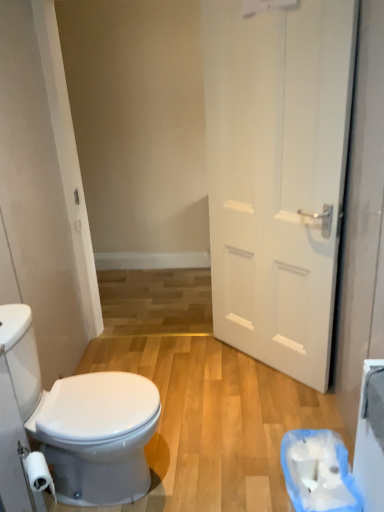
This screenshot has width=384, height=512. Describe the element at coordinates (320, 472) in the screenshot. I see `white paper at lower right, the 2th toilet paper positioned from the left` at that location.

Describe the element at coordinates (97, 436) in the screenshot. The width and height of the screenshot is (384, 512). I see `white glossy bidet at lower left` at that location.

Where is `white matte door at right`? white matte door at right is located at coordinates (277, 175).

Consider the image. What's the angular difference between white matte door at right and white glossy bidet at lower left's facing directions?

133 degrees.

Measure the distance from white matte door at right to white glossy bidet at lower left.

3.76 feet.

The image size is (384, 512). In order to click on bidet in front of the white matte door at right in this screenshot , I will do `click(97, 436)`.

From the image's perspective, is white matte door at right beneath white glossy bidet at lower left?

No, from the image's perspective, white matte door at right is not below white glossy bidet at lower left.

Which object is wider, white paper at lower right, arranged as the second toilet paper when viewed from the front, or white glossy bidet at lower left?

With larger width is white glossy bidet at lower left.

Is point (329, 464) in front of point (86, 390)?

Yes, point (329, 464) is in front of point (86, 390).

From the image's perspective, is white paper at lower right, arranged as the second toilet paper when viewed from the front, located above or below white glossy bidet at lower left?

A: Based on their image positions, white paper at lower right, arranged as the second toilet paper when viewed from the front, is located beneath white glossy bidet at lower left.

Would you say white paper at lower right, arranged as the second toilet paper when viewed from the front, contains white glossy bidet at lower left?

No.

Is white glossy bidet at lower left wider or thinner than white matte door at right?

Clearly, white glossy bidet at lower left has more width compared to white matte door at right.

In the scene shown: Which of these two, white glossy bidet at lower left or white matte door at right, stands taller?

white matte door at right.

From the image's perspective, does white glossy bidet at lower left appear lower than white matte door at right?

Yes.

In the scene shown: Does white glossy bidet at lower left have a smaller size compared to white matte toilet paper at lower left, the first toilet paper when ordered from left to right?

No, white glossy bidet at lower left is not smaller than white matte toilet paper at lower left, the first toilet paper when ordered from left to right.

From a real-world perspective, is white glossy bidet at lower left positioned under white matte toilet paper at lower left, which appears as the 1th toilet paper when viewed from the front, based on gravity?

Correct, in the physical world, white glossy bidet at lower left is lower than white matte toilet paper at lower left, which appears as the 1th toilet paper when viewed from the front.

From the image's perspective, which toilet paper is the 1st one below the white glossy bidet at lower left? Please provide its 2D coordinates.

[(38, 473)]

Looking at this image, which point is more forward, (96, 490) or (43, 459)?

The point (43, 459) is closer to the camera.

From the picture: Measure the distance between white matte toilet paper at lower left, the 2th toilet paper in the right-to-left sequence, and white paper at lower right, the 2th toilet paper positioned from the left.

A distance of 92.45 centimeters exists between white matte toilet paper at lower left, the 2th toilet paper in the right-to-left sequence, and white paper at lower right, the 2th toilet paper positioned from the left.

From a real-world perspective, who is located lower, white matte toilet paper at lower left, which appears as the 1th toilet paper when viewed from the front, or white paper at lower right, arranged as the second toilet paper when viewed from the front?

From a 3D spatial view, white paper at lower right, arranged as the second toilet paper when viewed from the front, is below.

Between white matte toilet paper at lower left, the first toilet paper when ordered from left to right, and white paper at lower right, arranged as the second toilet paper when viewed from the front, which one has more height?

white paper at lower right, arranged as the second toilet paper when viewed from the front.

From the image's perspective, is white matte toilet paper at lower left, the 2th toilet paper in the right-to-left sequence, located above or below white paper at lower right, acting as the first toilet paper starting from the right?

white matte toilet paper at lower left, the 2th toilet paper in the right-to-left sequence, is situated higher than white paper at lower right, acting as the first toilet paper starting from the right, in the image.

Is white matte door at right taller than white matte toilet paper at lower left, arranged as the 2th toilet paper when viewed from the back?

Correct, white matte door at right is much taller as white matte toilet paper at lower left, arranged as the 2th toilet paper when viewed from the back.

From the image's perspective, between white matte door at right and white matte toilet paper at lower left, the 2th toilet paper in the right-to-left sequence, who is located below?

white matte toilet paper at lower left, the 2th toilet paper in the right-to-left sequence, is shown below in the image.

Could you tell me if white matte door at right is facing white matte toilet paper at lower left, arranged as the 2th toilet paper when viewed from the back?

Yes, white matte door at right is oriented towards white matte toilet paper at lower left, arranged as the 2th toilet paper when viewed from the back.

Is white paper at lower right, which is counted as the 1th toilet paper, starting from the back, bigger or smaller than white matte toilet paper at lower left, the 2th toilet paper in the right-to-left sequence?

white paper at lower right, which is counted as the 1th toilet paper, starting from the back, is bigger than white matte toilet paper at lower left, the 2th toilet paper in the right-to-left sequence.

From their relative heights in the image, would you say white paper at lower right, acting as the first toilet paper starting from the right, is taller or shorter than white matte toilet paper at lower left, arranged as the 2th toilet paper when viewed from the back?

Considering their sizes, white paper at lower right, acting as the first toilet paper starting from the right, has more height than white matte toilet paper at lower left, arranged as the 2th toilet paper when viewed from the back.

Which object is further away from the camera taking this photo, white paper at lower right, which is counted as the 1th toilet paper, starting from the back, or white matte toilet paper at lower left, arranged as the 2th toilet paper when viewed from the back?

white paper at lower right, which is counted as the 1th toilet paper, starting from the back, is further from the camera.

Is white paper at lower right, arranged as the second toilet paper when viewed from the front, looking in the opposite direction of white matte toilet paper at lower left, the 2th toilet paper in the right-to-left sequence?

That's not correct — white paper at lower right, arranged as the second toilet paper when viewed from the front, is not looking away from white matte toilet paper at lower left, the 2th toilet paper in the right-to-left sequence.

Find the location of a particular element. The width and height of the screenshot is (384, 512). door lying on the right of white glossy bidet at lower left is located at coordinates (277, 175).

From the white glossy bidet at lower left, count 1st toilet papers forward and point to it. Please provide its 2D coordinates.

[(320, 472)]

From the image, which object appears to be farther from white matte toilet paper at lower left, the first toilet paper when ordered from left to right, white glossy bidet at lower left or white paper at lower right, the 2th toilet paper positioned from the left?

white paper at lower right, the 2th toilet paper positioned from the left.

In the scene shown: From the image, which object appears to be farther from white matte toilet paper at lower left, the 2th toilet paper in the right-to-left sequence, white matte door at right or white paper at lower right, the 2th toilet paper positioned from the left?

Based on the image, white matte door at right appears to be further to white matte toilet paper at lower left, the 2th toilet paper in the right-to-left sequence.

Considering their positions, is white matte toilet paper at lower left, the 2th toilet paper in the right-to-left sequence, positioned closer to white paper at lower right, the 2th toilet paper positioned from the left, than white glossy bidet at lower left?

Among the two, white glossy bidet at lower left is located nearer to white paper at lower right, the 2th toilet paper positioned from the left.

Consider the image. Considering their positions, is white matte toilet paper at lower left, arranged as the 2th toilet paper when viewed from the back, positioned closer to white paper at lower right, acting as the first toilet paper starting from the right, than white matte door at right?

The object closer to white paper at lower right, acting as the first toilet paper starting from the right, is white matte toilet paper at lower left, arranged as the 2th toilet paper when viewed from the back.

From the image, which object appears to be nearer to white glossy bidet at lower left, white matte toilet paper at lower left, which appears as the 1th toilet paper when viewed from the front, or white matte door at right?

white matte toilet paper at lower left, which appears as the 1th toilet paper when viewed from the front, is positioned closer to the anchor white glossy bidet at lower left.

Which object lies nearer to the anchor point white matte toilet paper at lower left, which appears as the 1th toilet paper when viewed from the front, white paper at lower right, acting as the first toilet paper starting from the right, or white glossy bidet at lower left?

white glossy bidet at lower left lies closer to white matte toilet paper at lower left, which appears as the 1th toilet paper when viewed from the front, than the other object.

In the scene shown: When comparing their distances from white matte door at right, does white paper at lower right, arranged as the second toilet paper when viewed from the front, or white glossy bidet at lower left seem further?

Among the two, white glossy bidet at lower left is located further to white matte door at right.

From the image, which object appears to be nearer to white matte door at right, white matte toilet paper at lower left, the first toilet paper when ordered from left to right, or white glossy bidet at lower left?

The object closer to white matte door at right is white glossy bidet at lower left.

I want to click on bidet between white matte door at right and white paper at lower right, acting as the first toilet paper starting from the right, in the vertical direction, so click(97, 436).

Locate an element on the screen. This screenshot has width=384, height=512. bidet between white matte door at right and white matte toilet paper at lower left, which appears as the 1th toilet paper when viewed from the front, in the up-down direction is located at coordinates (97, 436).

Where is `toilet paper between white matte door at right and white paper at lower right, which is counted as the 1th toilet paper, starting from the back, in the vertical direction`? Image resolution: width=384 pixels, height=512 pixels. toilet paper between white matte door at right and white paper at lower right, which is counted as the 1th toilet paper, starting from the back, in the vertical direction is located at coordinates (38, 473).

I want to click on bidet between white matte toilet paper at lower left, the first toilet paper when ordered from left to right, and white paper at lower right, acting as the first toilet paper starting from the right, in the horizontal direction, so click(97, 436).